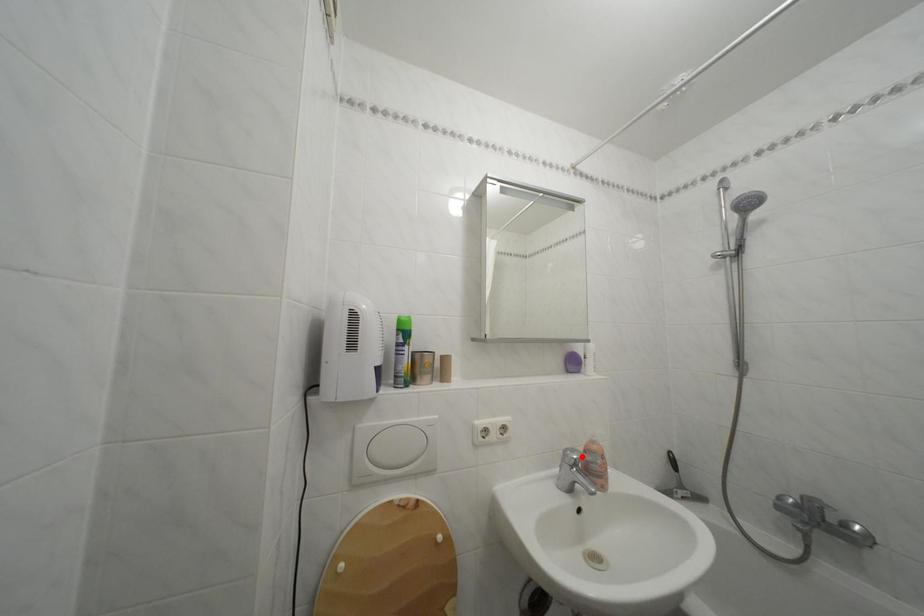
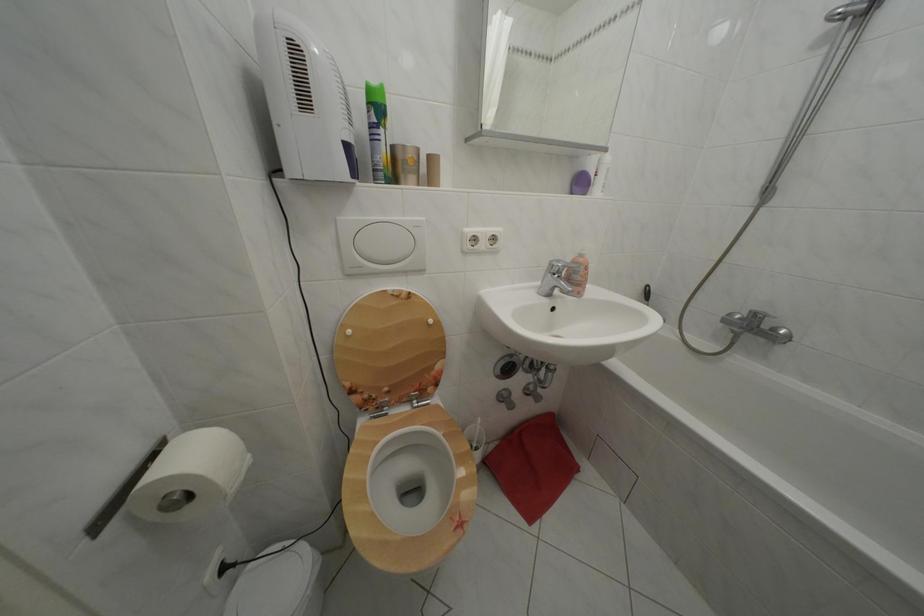
The point at the highlighted location is marked in the first image. Where is the corresponding point in the second image?

(567, 268)